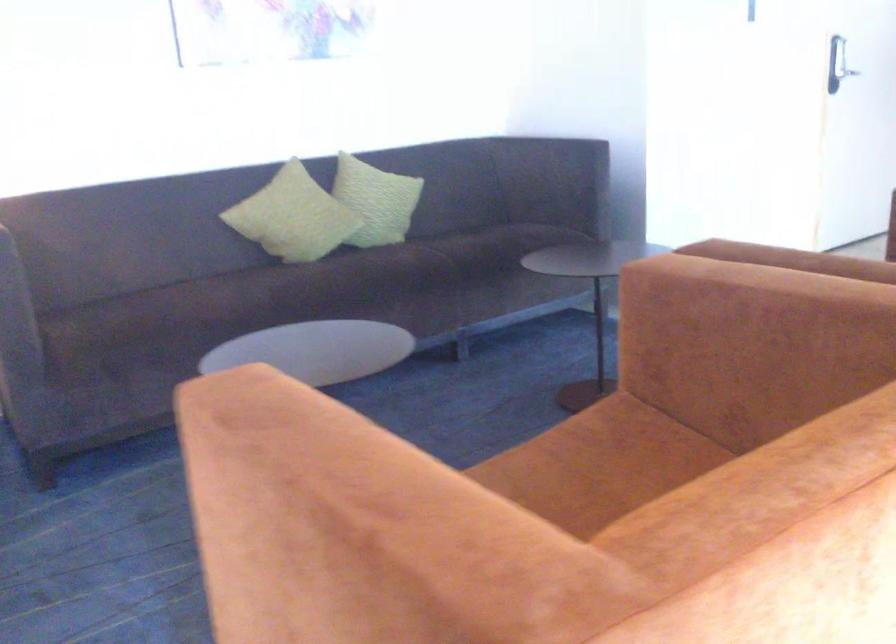
You are a GUI agent. You are given a task and a screenshot of the screen. Output one action in this format:
    pyautogui.click(x=<x>, y=<y>)
    Task: Click on the orange sofa sitting surface
    
    Given the screenshot: What is the action you would take?
    pyautogui.click(x=562, y=455)